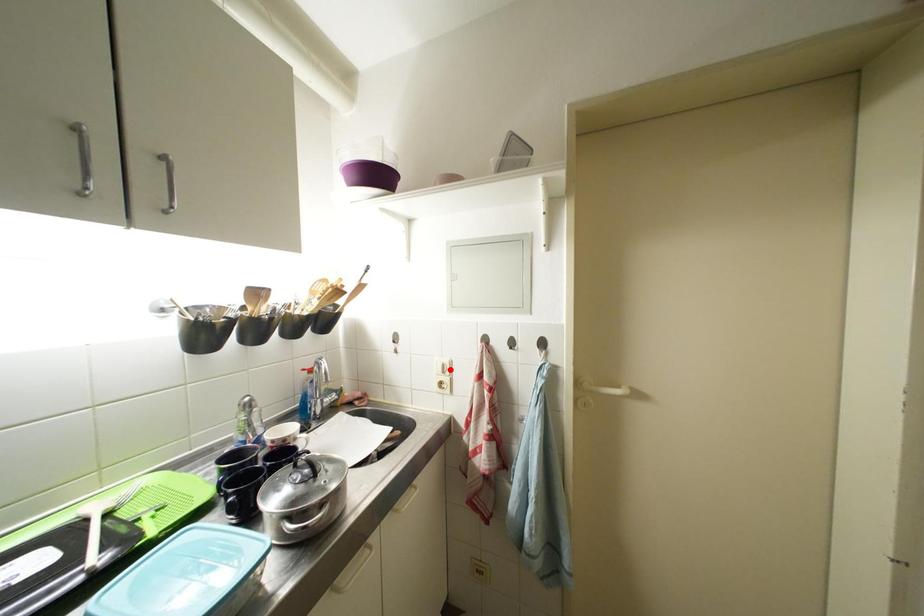
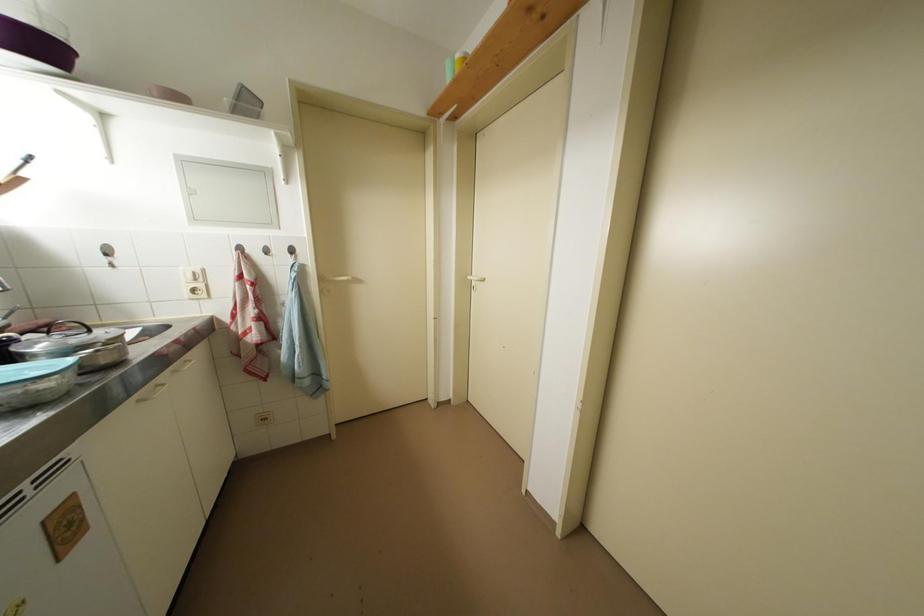
Locate, in the second image, the point that corresponds to the highlighted location in the first image.

(201, 277)